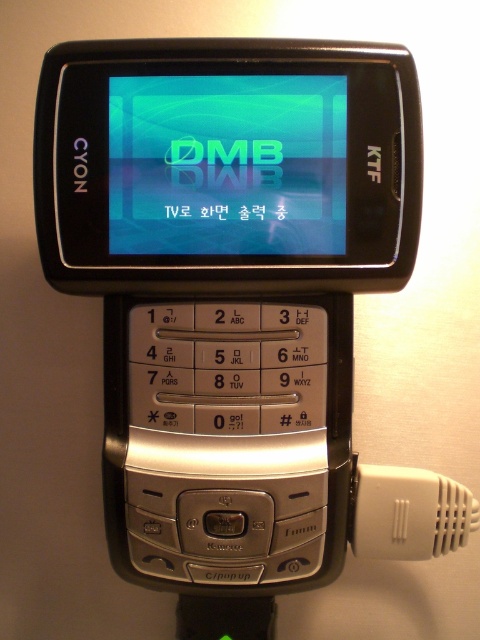
Question: Is matte blue screen at center to the right of white plastic connector at lower right from the viewer's perspective?

Choices:
 (A) no
 (B) yes

Answer: (A)

Question: Which point appears farthest from the camera in this image?

Choices:
 (A) (355, 480)
 (B) (252, 196)

Answer: (A)

Question: Is matte blue screen at center to the right of white plastic connector at lower right from the viewer's perspective?

Choices:
 (A) no
 (B) yes

Answer: (A)

Question: Is matte blue screen at center smaller than white plastic connector at lower right?

Choices:
 (A) yes
 (B) no

Answer: (A)